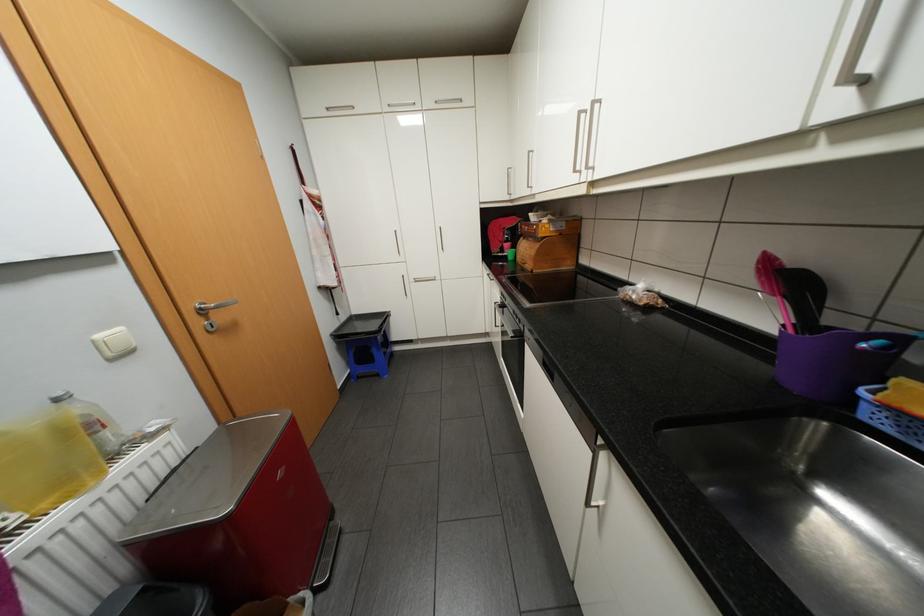
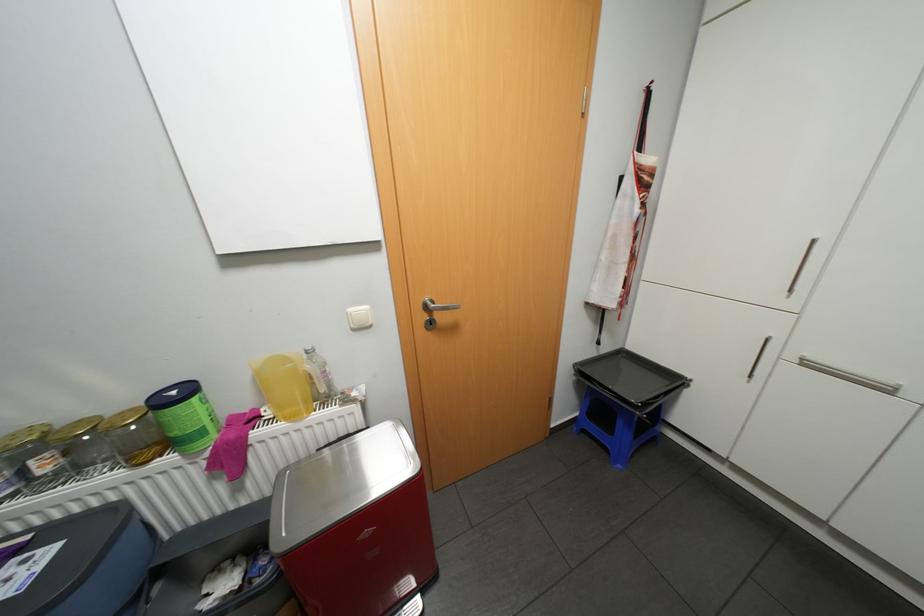
Find the pixel in the second image that matches [423,280] in the first image.

(813, 363)